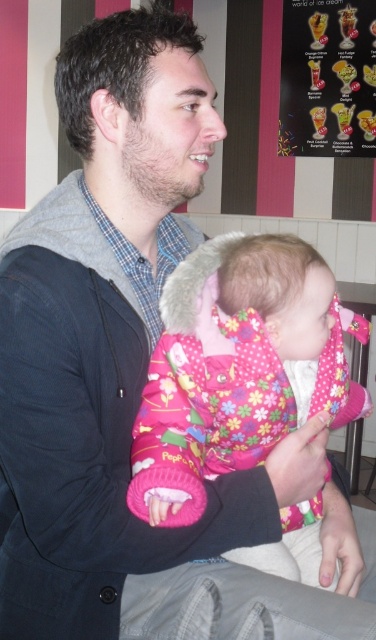
Is fluffy pink jacket at center taller than vibrant plastic ice cream cones at upper right?

In fact, fluffy pink jacket at center may be shorter than vibrant plastic ice cream cones at upper right.

Between fluffy pink jacket at center and vibrant plastic ice cream cones at upper right, which one has less height?

Standing shorter between the two is fluffy pink jacket at center.

Is point (304, 524) more distant than point (333, 54)?

No, it is in front of (333, 54).

Locate an element on the screen. fluffy pink jacket at center is located at coordinates (236, 369).